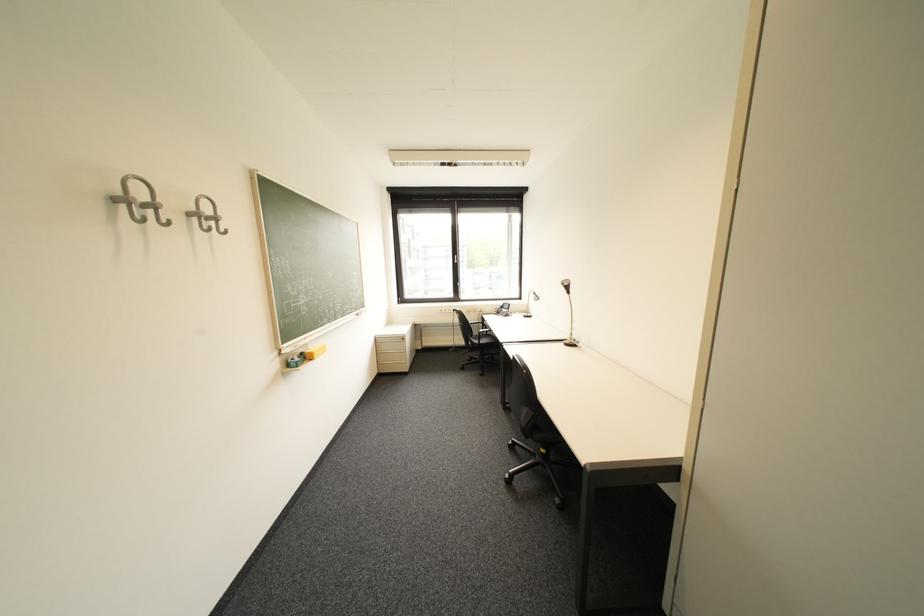
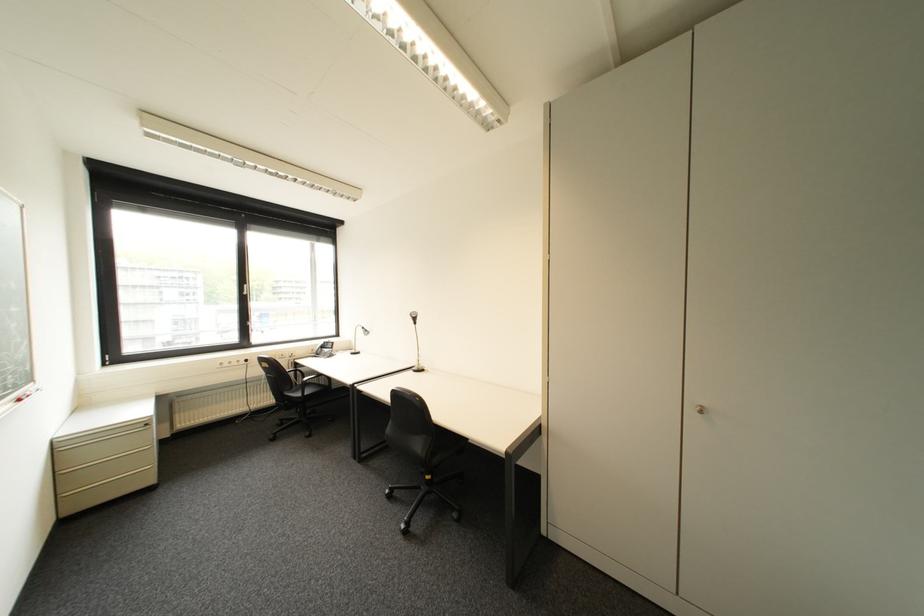
Question: The camera is either moving clockwise (left) or counter-clockwise (right) around the object. The first image is from the beginning of the video and the second image is from the end. Is the camera moving left or right when shooting the video?

Choices:
 (A) Left
 (B) Right

Answer: (A)